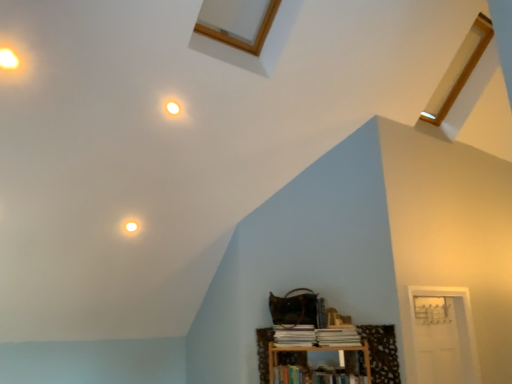
Question: Is white paper book at lower center, which is the 1th book from top to bottom, positioned behind white glossy light fixture at upper left, arranged as the second dot when ordered from the bottom?

Choices:
 (A) no
 (B) yes

Answer: (B)

Question: From the image's perspective, is white paper book at lower center, which is the 1th book from top to bottom, below white glossy light fixture at upper left, arranged as the second dot when ordered from the bottom?

Choices:
 (A) yes
 (B) no

Answer: (A)

Question: Does white paper book at lower center, positioned as the 3th book in bottom-to-top order, turn towards white glossy light fixture at upper left, arranged as the 2th dot when viewed from the back?

Choices:
 (A) no
 (B) yes

Answer: (A)

Question: From a real-world perspective, is white paper book at lower center, positioned as the 3th book in bottom-to-top order, located beneath white glossy light fixture at upper left, the 2th dot from the right?

Choices:
 (A) yes
 (B) no

Answer: (A)

Question: Is white paper book at lower center, which is the 1th book from top to bottom, to the left of white glossy light fixture at upper left, arranged as the second dot when ordered from the bottom, from the viewer's perspective?

Choices:
 (A) yes
 (B) no

Answer: (B)

Question: Considering the relative positions of hardcover book at lower center, the third book in the top-to-bottom sequence, and white glossy light fixture at upper left, arranged as the 2th dot when viewed from the back, in the image provided, is hardcover book at lower center, the third book in the top-to-bottom sequence, to the left or to the right of white glossy light fixture at upper left, arranged as the 2th dot when viewed from the back,?

Choices:
 (A) left
 (B) right

Answer: (B)

Question: In terms of size, does hardcover book at lower center, the third book in the top-to-bottom sequence, appear bigger or smaller than white glossy light fixture at upper left, arranged as the second dot when ordered from the bottom?

Choices:
 (A) small
 (B) big

Answer: (B)

Question: Is hardcover book at lower center, the third book in the top-to-bottom sequence, wider or thinner than white glossy light fixture at upper left, the 2th dot from the right?

Choices:
 (A) wide
 (B) thin

Answer: (A)

Question: Considering the positions of point (338, 370) and point (5, 61), is point (338, 370) closer or farther from the camera than point (5, 61)?

Choices:
 (A) farther
 (B) closer

Answer: (A)

Question: In the image, is white paper book at lower center, positioned as the 3th book in bottom-to-top order, on the left side or the right side of white paper book at lower center, marked as the second book in a top-to-bottom arrangement?

Choices:
 (A) right
 (B) left

Answer: (A)

Question: From the image's perspective, relative to white paper book at lower center, marked as the second book in a top-to-bottom arrangement, is white paper book at lower center, positioned as the 3th book in bottom-to-top order, above or below?

Choices:
 (A) above
 (B) below

Answer: (A)

Question: Is white paper book at lower center, positioned as the 3th book in bottom-to-top order, wider or thinner than white paper book at lower center, marked as the second book in a top-to-bottom arrangement?

Choices:
 (A) wide
 (B) thin

Answer: (B)

Question: In the image, is white paper book at lower center, which is the 1th book from top to bottom, positioned in front of or behind white paper book at lower center, the 2th book when ordered from bottom to top?

Choices:
 (A) front
 (B) behind

Answer: (A)

Question: Relative to hardcover book at lower center, the first book ordered from the bottom, is wooden bookshelf at lower right in front or behind?

Choices:
 (A) front
 (B) behind

Answer: (B)

Question: From a real-world perspective, relative to hardcover book at lower center, the third book in the top-to-bottom sequence, is wooden bookshelf at lower right vertically above or below?

Choices:
 (A) below
 (B) above

Answer: (B)